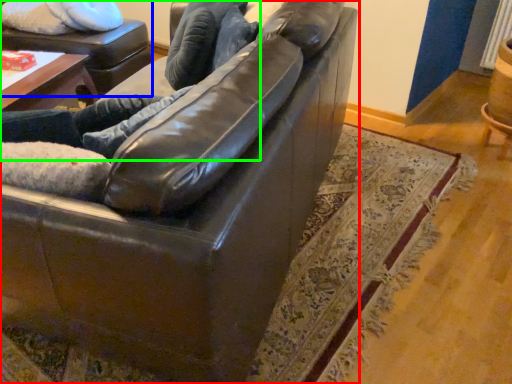
Question: Considering the real-world distances, which object is closest to studio couch (highlighted by a red box)? swivel chair (highlighted by a blue box) or couple (highlighted by a green box).

Choices:
 (A) swivel chair
 (B) couple

Answer: (B)